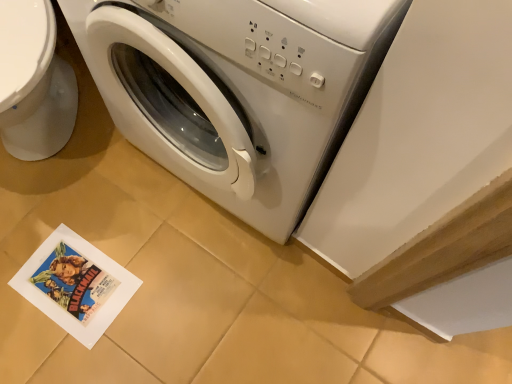
The image size is (512, 384). I want to click on free space in front of white glossy toilet bowl at left, so click(x=69, y=234).